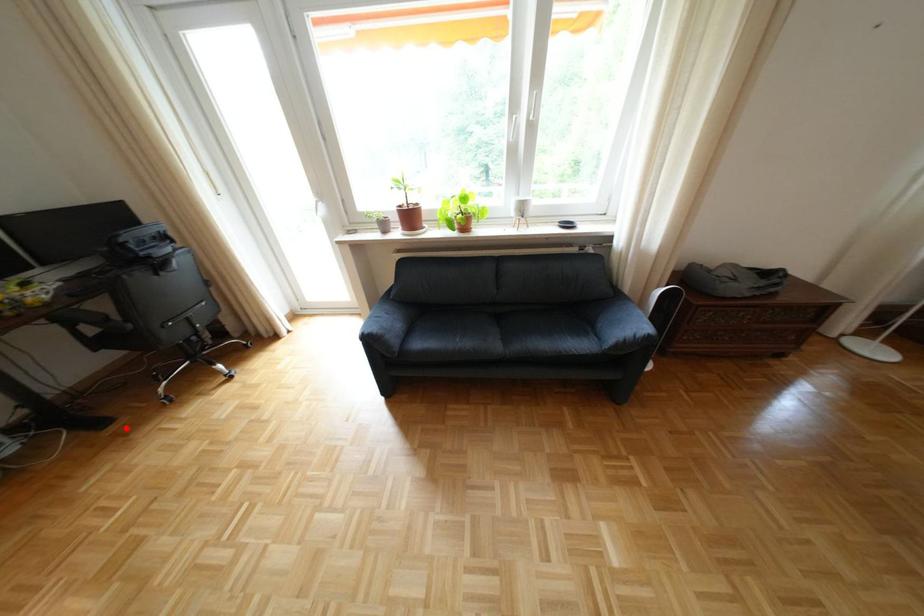
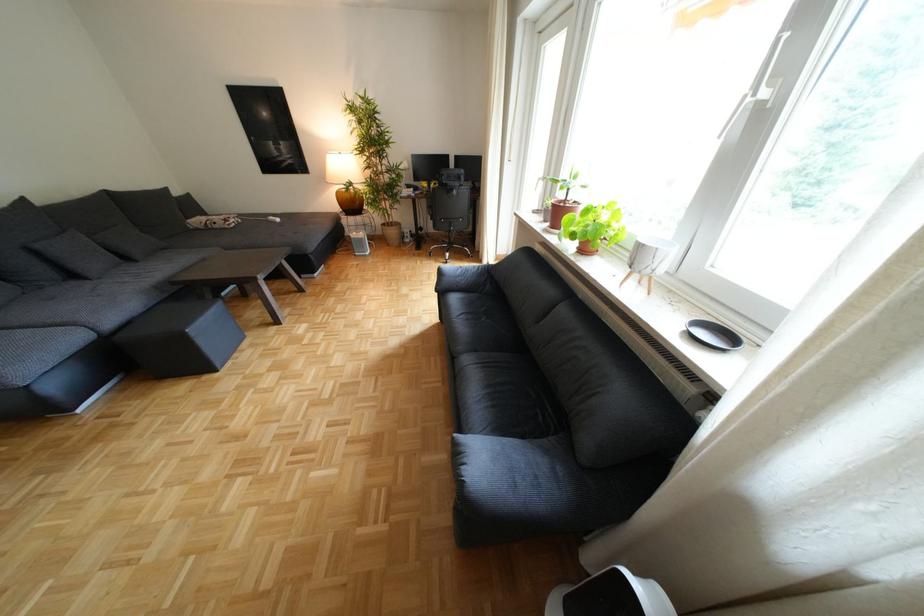
Locate, in the second image, the point that corresponds to the highlighted location in the first image.

(430, 252)